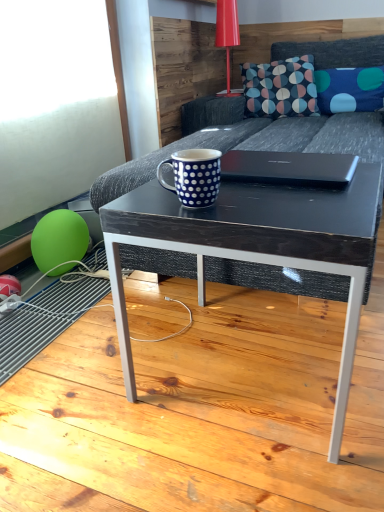
Question: Considering the positions of blue dotted mug at center and glossy plastic table lamp at upper center in the image, is blue dotted mug at center taller or shorter than glossy plastic table lamp at upper center?

Choices:
 (A) short
 (B) tall

Answer: (A)

Question: From the image's perspective, relative to glossy plastic table lamp at upper center, is blue dotted mug at center above or below?

Choices:
 (A) below
 (B) above

Answer: (A)

Question: Considering the real-world distances, which object is farthest from the glossy plastic table lamp at upper center?

Choices:
 (A) dark wood/black textured coffee table at center
 (B) black matte laptop at center
 (C) blue dotted mug at center
 (D) dark gray fabric couch at center
 (E) green rubber balloon at lower left

Answer: (A)

Question: Which of these objects is positioned farthest from the dark wood/black textured coffee table at center?

Choices:
 (A) dark blue fabric pillow with colorful circles at upper center
 (B) black matte laptop at center
 (C) dark gray fabric couch at center
 (D) green rubber balloon at lower left
 (E) blue dotted fabric pillow at upper right

Answer: (E)